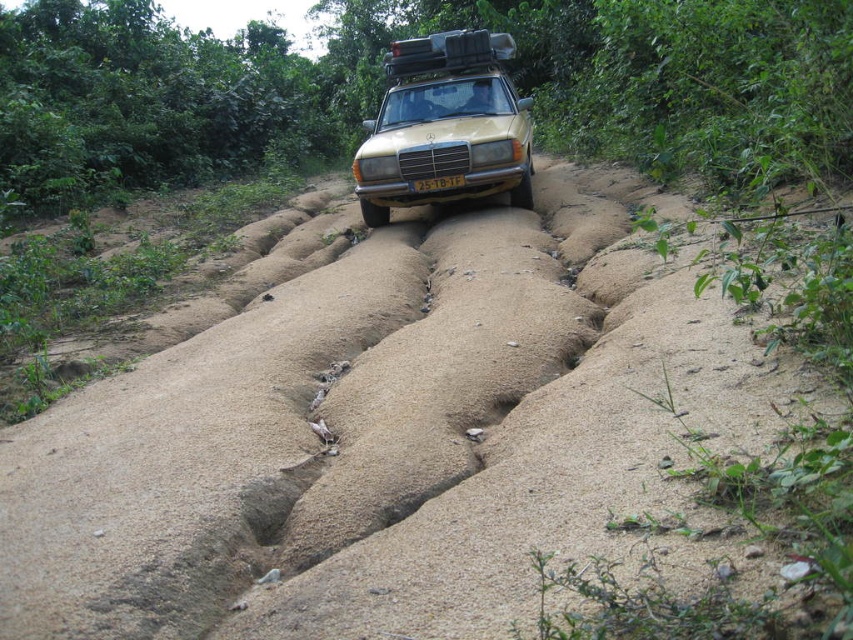
From the picture: Does gold matte car at center appear over yellow matte license plate at center?

Indeed, gold matte car at center is positioned over yellow matte license plate at center.

Locate an element on the screen. gold matte car at center is located at coordinates (445, 125).

Locate an element on the screen. This screenshot has height=640, width=853. gold matte car at center is located at coordinates (445, 125).